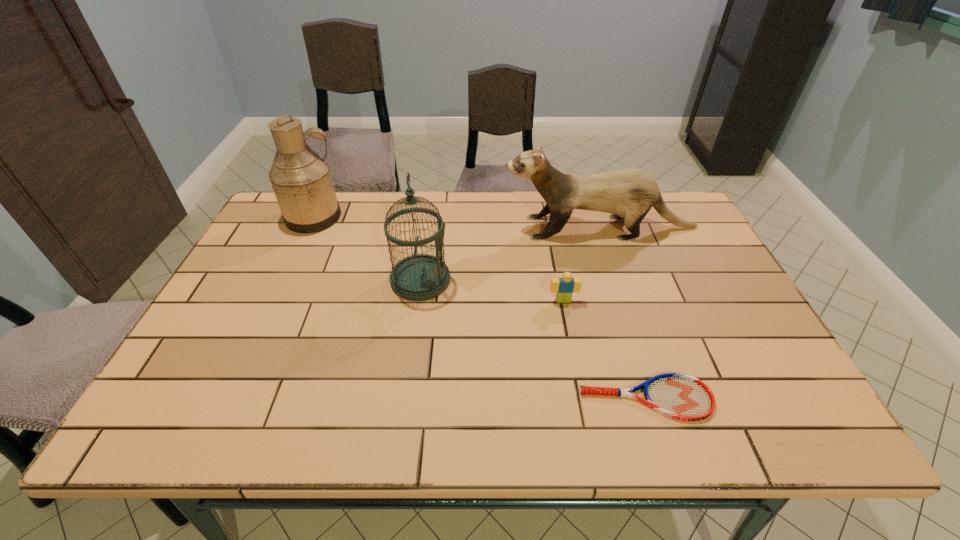
Locate an element on the screen. free space located 0.330m on the face of the third tallest object is located at coordinates (396, 228).

You are a GUI agent. You are given a task and a screenshot of the screen. Output one action in this format:
    pyautogui.click(x=<x>, y=<y>)
    Task: Click on the vacant space located on the face of the second shortest object
    This screenshot has height=540, width=960.
    Given the screenshot: What is the action you would take?
    pyautogui.click(x=583, y=402)

In order to click on free space located on the back of the tennis racket in this screenshot , I will do `click(620, 314)`.

Where is `pitcher that is positioned at the far edge`? The width and height of the screenshot is (960, 540). pitcher that is positioned at the far edge is located at coordinates (301, 179).

Where is `ferret at the far edge`? This screenshot has width=960, height=540. ferret at the far edge is located at coordinates (630, 193).

What are the coordinates of `object that is positioned at the near edge` in the screenshot? It's located at (679, 396).

What are the coordinates of `object located at the left edge` in the screenshot? It's located at (301, 179).

Image resolution: width=960 pixels, height=540 pixels. Find the location of `object located at the right edge`. object located at the right edge is located at coordinates (630, 193).

In order to click on object located in the far left corner section of the desktop in this screenshot , I will do `click(301, 179)`.

This screenshot has width=960, height=540. In order to click on object that is at the far right corner in this screenshot , I will do `click(630, 193)`.